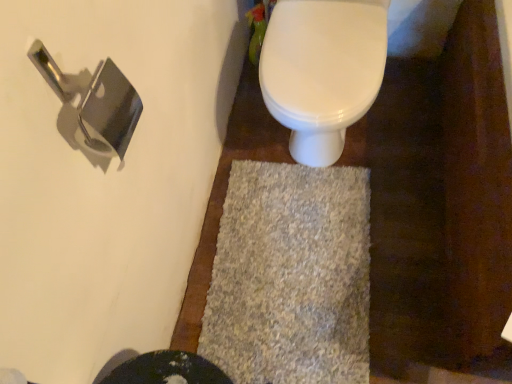
Question: Is polished silver door handle at upper left wider or thinner than gray shaggy bath mat at center?

Choices:
 (A) wide
 (B) thin

Answer: (B)

Question: Considering the relative positions of polished silver door handle at upper left and gray shaggy bath mat at center in the image provided, is polished silver door handle at upper left to the left or to the right of gray shaggy bath mat at center?

Choices:
 (A) left
 (B) right

Answer: (A)

Question: Which object is positioned closest to the white glossy toilet at upper center?

Choices:
 (A) gray shaggy bath mat at center
 (B) polished silver door handle at upper left

Answer: (A)

Question: Considering the real-world distances, which object is closest to the white glossy toilet at upper center?

Choices:
 (A) gray shaggy bath mat at center
 (B) polished silver door handle at upper left

Answer: (A)